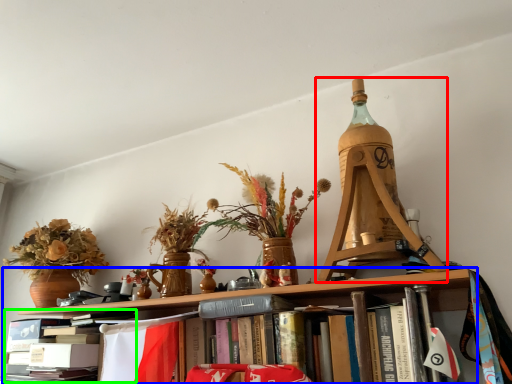
Question: Estimate the real-world distances between objects in this image. Which object is closer to Eiffel tower (highlighted by a red box), shelf (highlighted by a blue box) or book (highlighted by a green box)?

Choices:
 (A) shelf
 (B) book

Answer: (A)